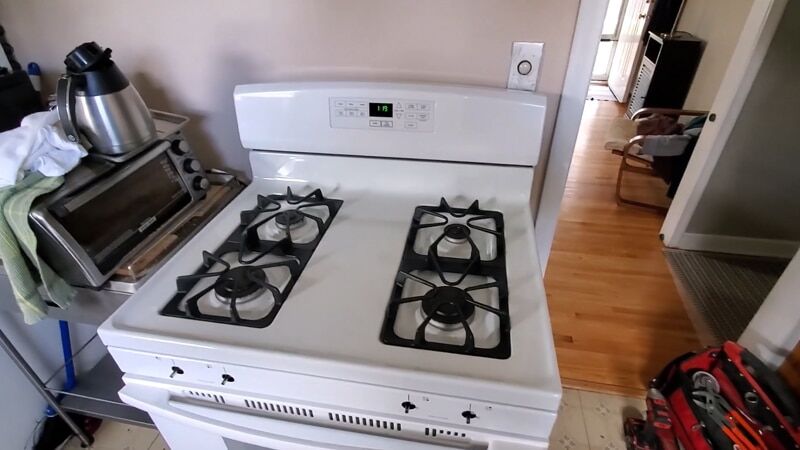
This screenshot has width=800, height=450. I want to click on handle, so click(x=153, y=405), click(x=64, y=93), click(x=137, y=165).